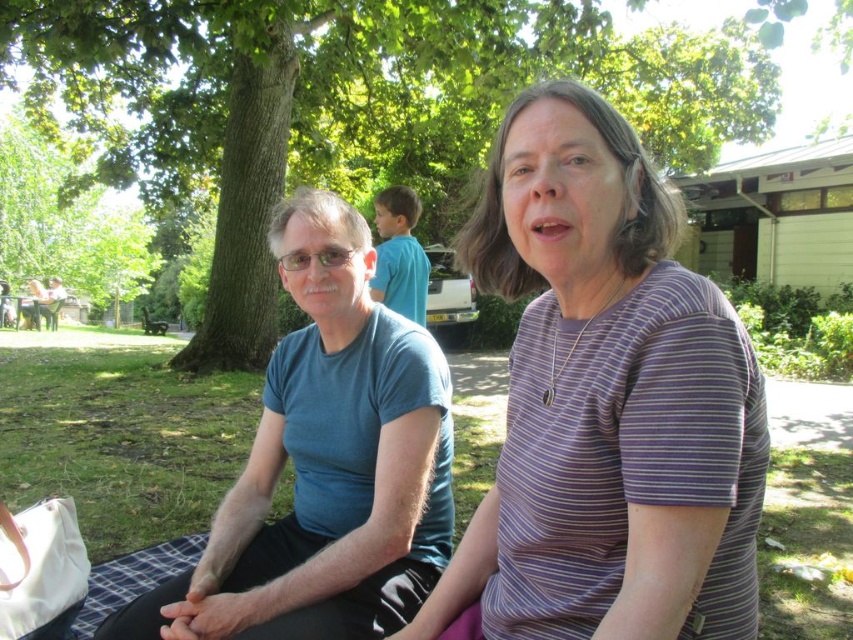
You are a photographer trying to capture a photo of the purple striped shirt at center and the green leafy tree at center. Which object should you focus on first if you want to ensure both are in focus, considering their distances from the camera?

You should focus on the green leafy tree at center first because it is farther away than the purple striped shirt at center, so adjusting focus from the tree to the shirt will help ensure both are in focus.